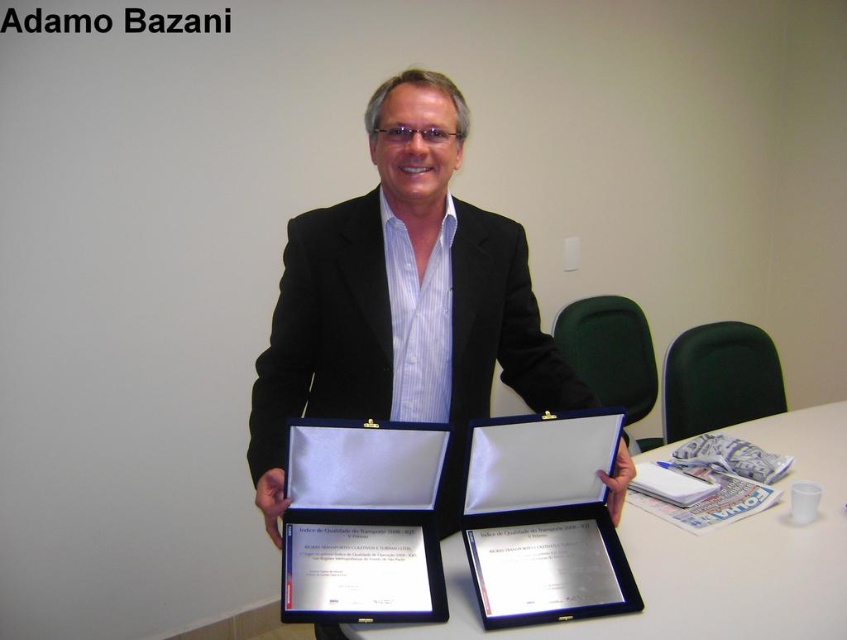
Question: Can you confirm if silver metallic plaque at center is positioned to the right of satin silver certificate at center?

Choices:
 (A) yes
 (B) no

Answer: (A)

Question: Is black matte suit at center smaller than blue fabric table at center?

Choices:
 (A) yes
 (B) no

Answer: (A)

Question: Which point is farther from the camera taking this photo?

Choices:
 (A) (385, 580)
 (B) (523, 634)

Answer: (B)

Question: Which of the following is the farthest from the observer?

Choices:
 (A) (613, 580)
 (B) (386, 516)

Answer: (A)

Question: Is black matte suit at center thinner than satin silver certificate at center?

Choices:
 (A) no
 (B) yes

Answer: (A)

Question: Estimate the real-world distances between objects in this image. Which object is closer to the black matte suit at center?

Choices:
 (A) silver metallic plaque at center
 (B) blue fabric table at center

Answer: (A)